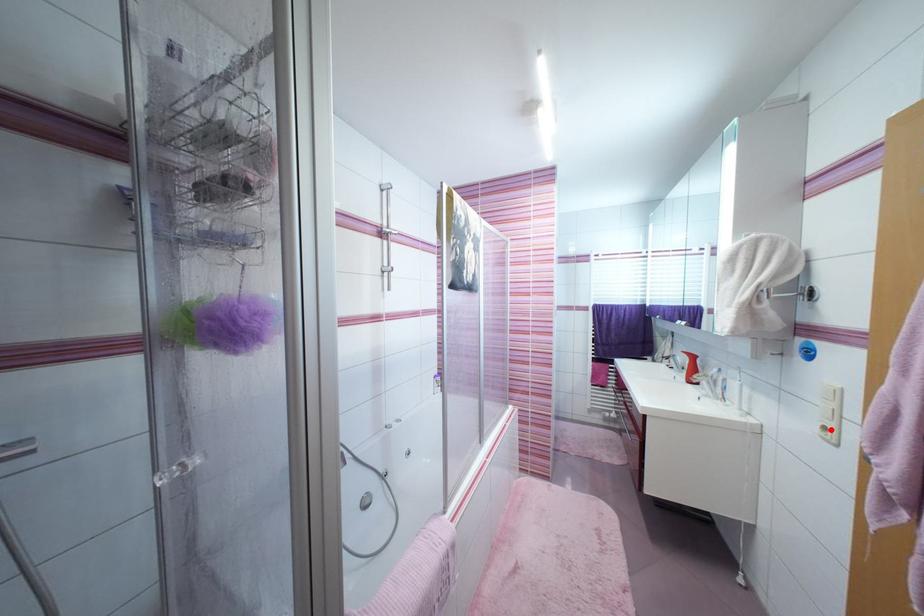
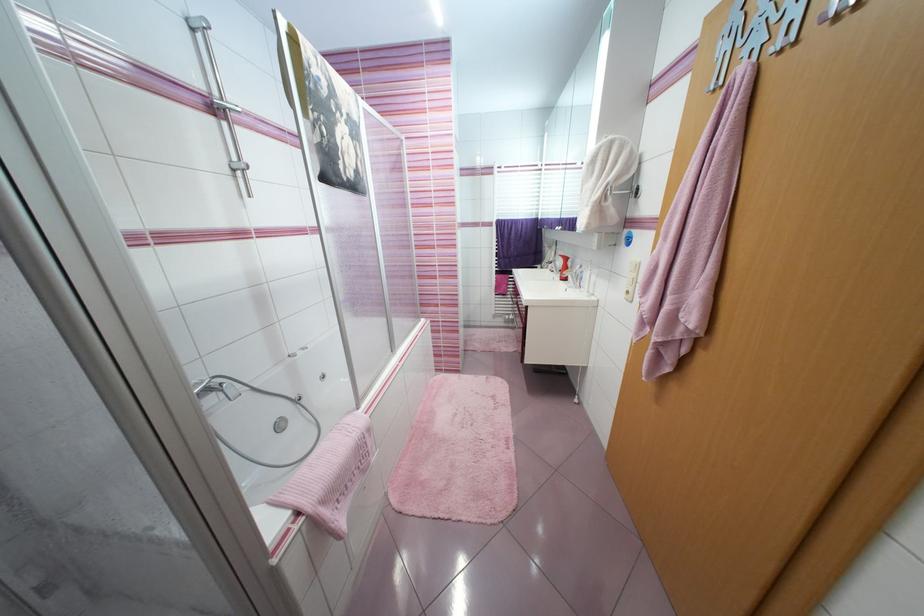
Question: I am providing you with two images of the same scene from different viewpoints. Given a red point in image1, look at the same physical point in image2. Is it:

Choices:
 (A) Closer to the viewpoint
 (B) Farther from the viewpoint

Answer: (A)